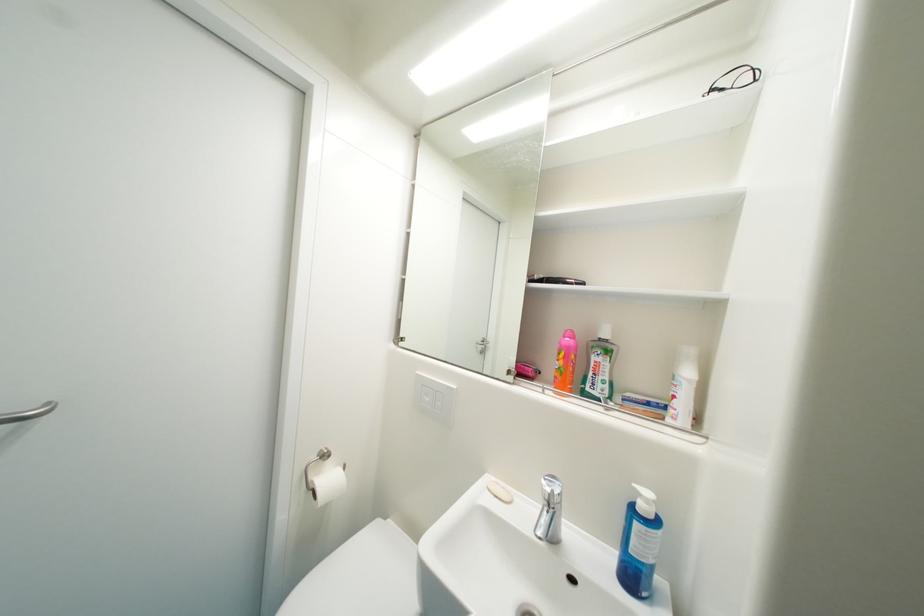
This screenshot has width=924, height=616. Describe the element at coordinates (550, 511) in the screenshot. I see `a chrome faucet handle` at that location.